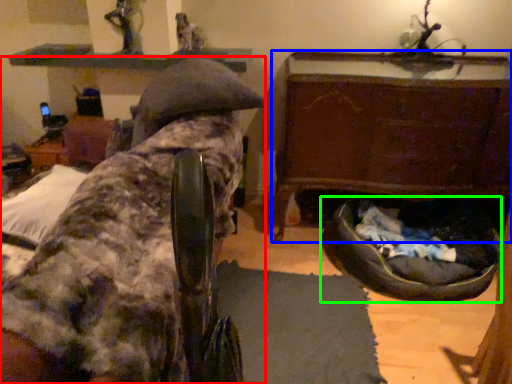
Question: Which object is the farthest from furniture (highlighted by a red box)? Choose among these: furniture (highlighted by a blue box) or dog bed (highlighted by a green box).

Choices:
 (A) furniture
 (B) dog bed

Answer: (B)